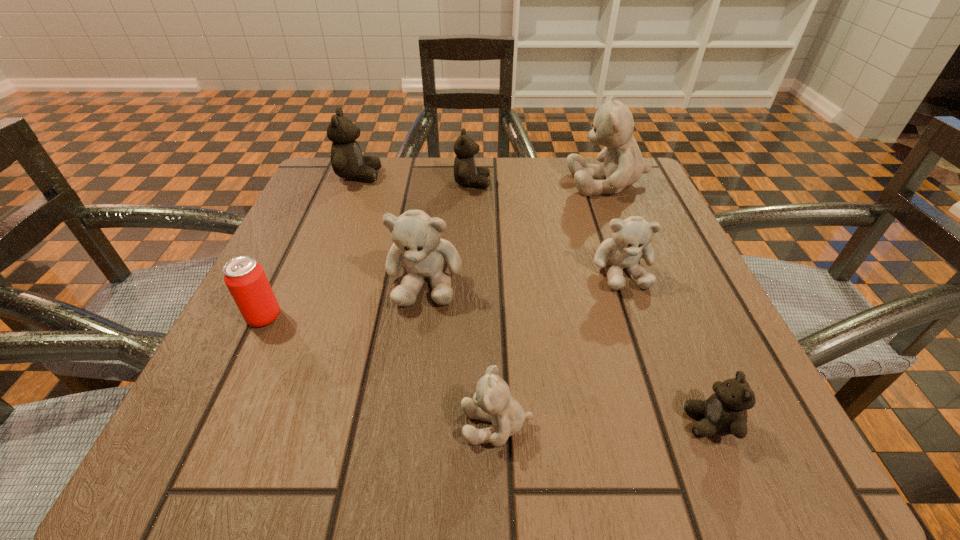
Image resolution: width=960 pixels, height=540 pixels. Find the location of `vacant position located 0.400m on the face of the nearest brown teddy bear`. vacant position located 0.400m on the face of the nearest brown teddy bear is located at coordinates (371, 423).

Find the location of a particular element. free space located on the face of the nearest brown teddy bear is located at coordinates (496, 423).

Where is `vacant space situated on the face of the nearest brown teddy bear`? This screenshot has width=960, height=540. vacant space situated on the face of the nearest brown teddy bear is located at coordinates (x=638, y=423).

Find the location of `vacant space situated on the face of the smallest gray teddy bear`. vacant space situated on the face of the smallest gray teddy bear is located at coordinates (406, 424).

At what (x,y) coordinates should I click in order to perform the action: click on free spot located 0.340m on the face of the smallest gray teddy bear. Please return your answer as a coordinate pair (x, y). Looking at the image, I should click on (192, 424).

The image size is (960, 540). Identify the location of free space located 0.160m on the face of the smallest gray teddy bear. (334, 424).

This screenshot has height=540, width=960. Find the location of `teddy bear that is at the left edge`. teddy bear that is at the left edge is located at coordinates (347, 161).

The image size is (960, 540). What are the coordinates of `beer can that is at the left edge` in the screenshot? It's located at (245, 279).

Locate an element on the screen. object that is positioned at the far left corner is located at coordinates (347, 161).

Where is `object that is positioned at the far right corner`? This screenshot has height=540, width=960. object that is positioned at the far right corner is located at coordinates (623, 164).